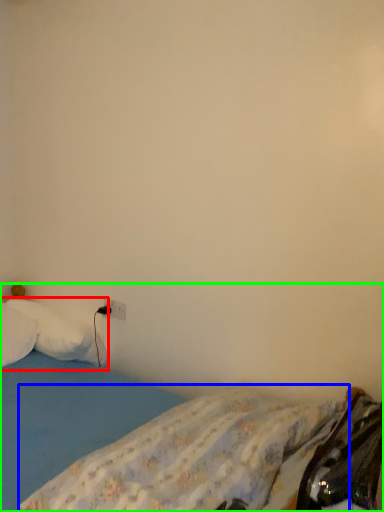
Question: Which object is positioned farthest from pillow (highlighted by a red box)? Select from mattress (highlighted by a blue box) and bed (highlighted by a green box).

Choices:
 (A) mattress
 (B) bed

Answer: (A)